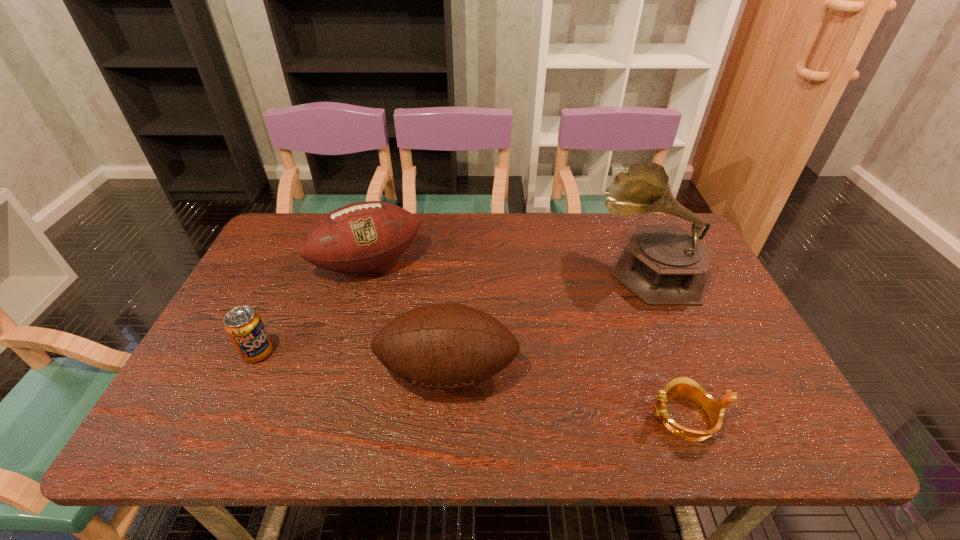
Image resolution: width=960 pixels, height=540 pixels. What are the coordinates of `vacant space located 0.070m on the laces of the nearer football` in the screenshot? It's located at (444, 438).

Locate an element on the screen. blank space located on the back of the fourth tallest object is located at coordinates (294, 276).

I want to click on free space located 0.280m at the front emblem of the tiara, so click(x=516, y=417).

In order to click on free spot located at the front emblem of the tiara in this screenshot , I will do `click(586, 417)`.

Find the location of a particular element. The image size is (960, 540). free point located at the front emblem of the tiara is located at coordinates (468, 417).

At what (x,y) coordinates should I click in order to perform the action: click on phonograph record positioned at the far edge. Please return your answer as a coordinate pair (x, y). This screenshot has width=960, height=540. Looking at the image, I should click on (663, 265).

Find the location of a particular element. The height and width of the screenshot is (540, 960). football (American) that is at the far edge is located at coordinates (363, 236).

Where is `object located in the near edge section of the desktop`? The image size is (960, 540). object located in the near edge section of the desktop is located at coordinates (681, 387).

At what (x,y) coordinates should I click in order to perform the action: click on object located in the left edge section of the desktop. Please return your answer as a coordinate pair (x, y). Looking at the image, I should click on (244, 327).

The image size is (960, 540). In order to click on phonograph record located in the right edge section of the desktop in this screenshot , I will do click(663, 265).